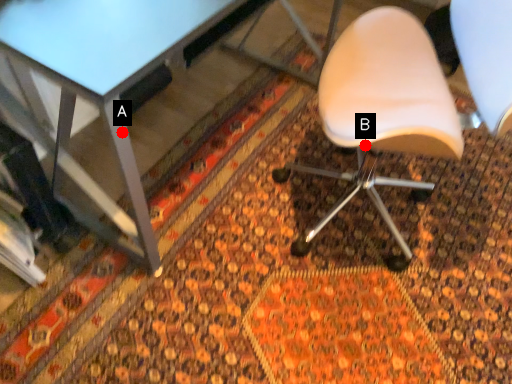
Question: Two points are circled on the image, labeled by A and B beside each circle. Which point is further to the camera?

Choices:
 (A) A is further
 (B) B is further

Answer: (B)